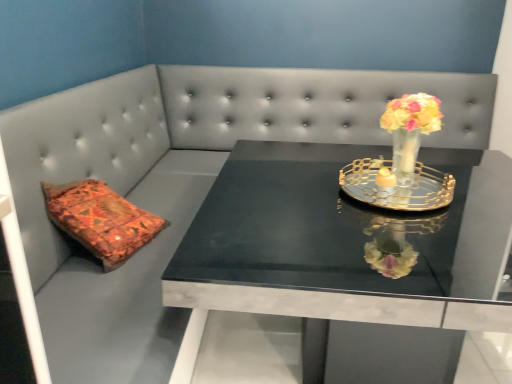
Question: Is black marble table at center far from gold metallic tray at center?

Choices:
 (A) yes
 (B) no

Answer: (B)

Question: Is black marble table at center completely or partially outside of gold metallic tray at center?

Choices:
 (A) yes
 (B) no

Answer: (A)

Question: Is black marble table at center placed right next to gold metallic tray at center?

Choices:
 (A) no
 (B) yes

Answer: (A)

Question: From a real-world perspective, is black marble table at center positioned under gold metallic tray at center based on gravity?

Choices:
 (A) yes
 (B) no

Answer: (A)

Question: Can you confirm if black marble table at center is bigger than gold metallic tray at center?

Choices:
 (A) yes
 (B) no

Answer: (A)

Question: From the image's perspective, is black marble table at center on top of gold metallic tray at center?

Choices:
 (A) yes
 (B) no

Answer: (B)

Question: Is gold metallic tray at center placed right next to black marble table at center?

Choices:
 (A) yes
 (B) no

Answer: (B)

Question: Does gold metallic tray at center have a smaller size compared to black marble table at center?

Choices:
 (A) no
 (B) yes

Answer: (B)

Question: From a real-world perspective, is gold metallic tray at center located higher than black marble table at center?

Choices:
 (A) yes
 (B) no

Answer: (A)

Question: Can you confirm if gold metallic tray at center is taller than black marble table at center?

Choices:
 (A) yes
 (B) no

Answer: (B)

Question: Could you tell me if gold metallic tray at center is facing black marble table at center?

Choices:
 (A) yes
 (B) no

Answer: (B)

Question: From the image's perspective, is gold metallic tray at center below black marble table at center?

Choices:
 (A) yes
 (B) no

Answer: (B)

Question: From a real-world perspective, is gold metallic tray at center on top of translucent glass vase at upper right?

Choices:
 (A) yes
 (B) no

Answer: (B)